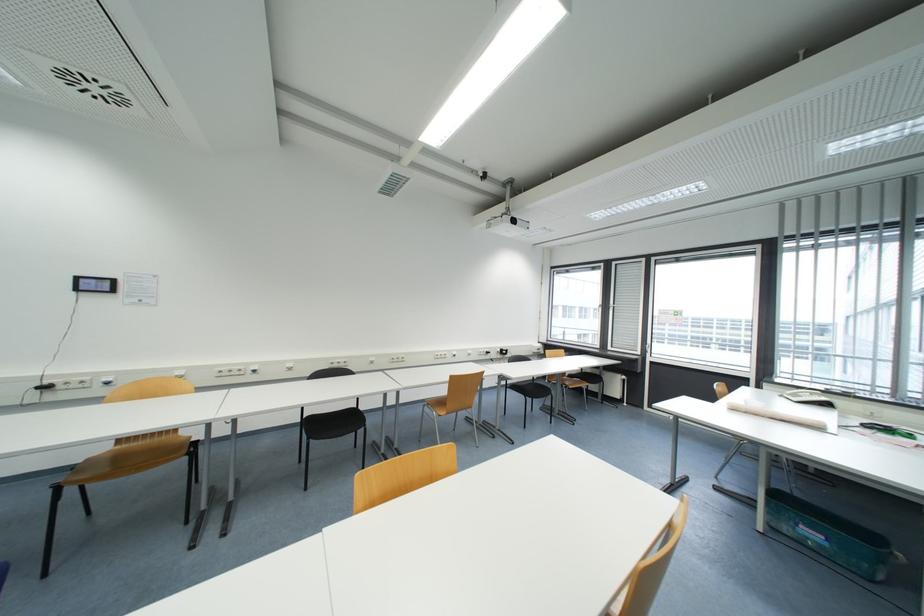
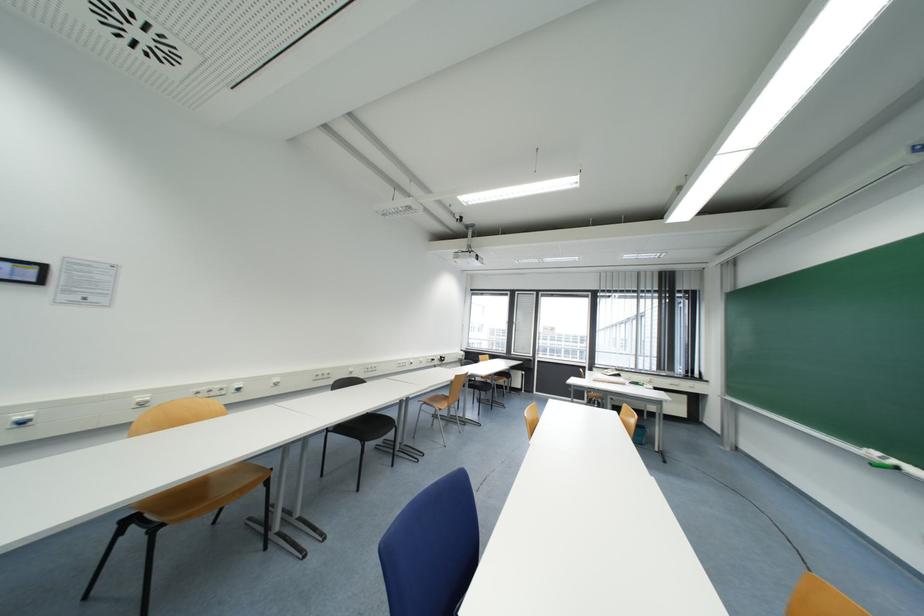
Locate, in the second image, the point that corresponds to [113,385] in the first image.

(28, 424)